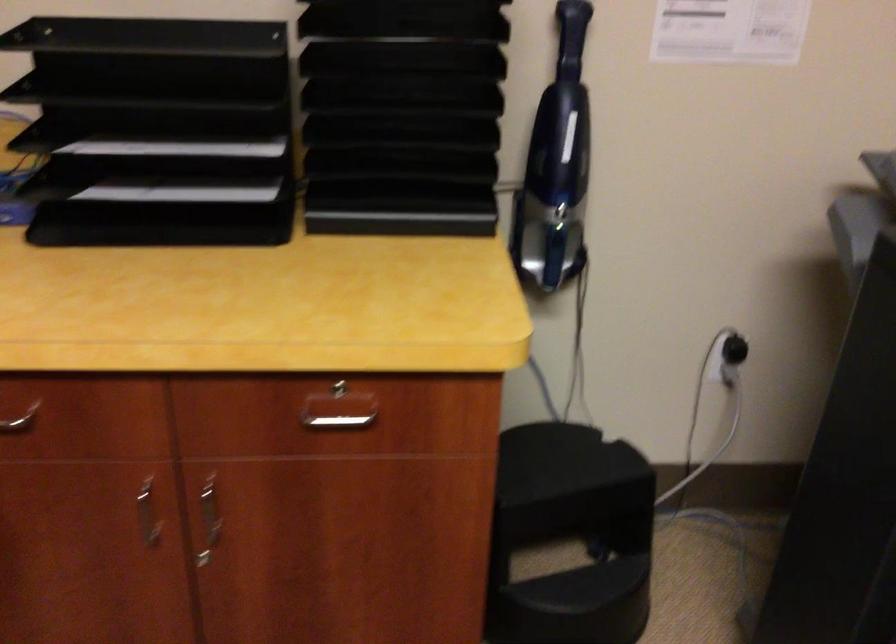
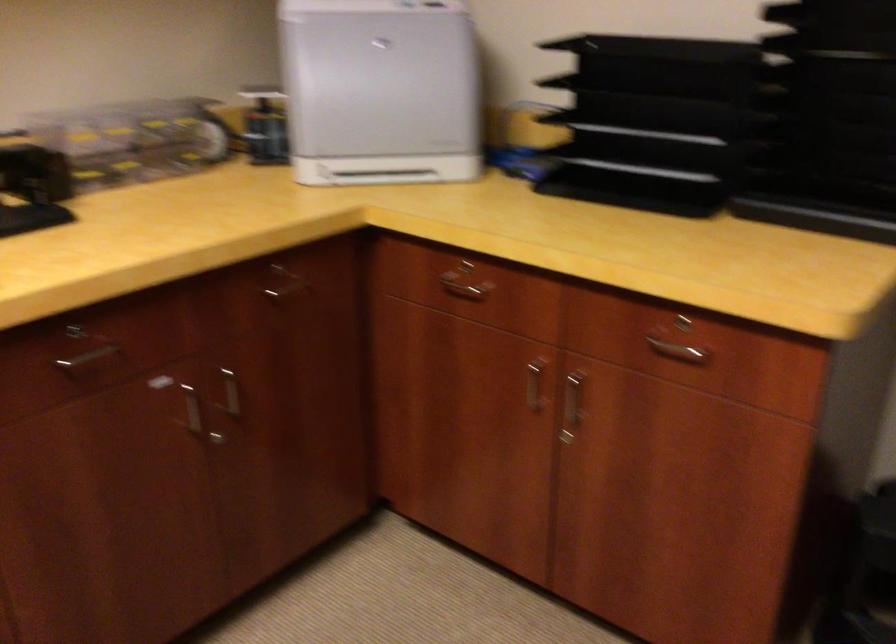
Question: I am providing you with two images of the same scene from different viewpoints. Please identify which objects are invisible in image2.

Choices:
 (A) metal cabinet handle
 (B) black paper tray
 (C) drawer lock
 (D) none of these

Answer: (D)